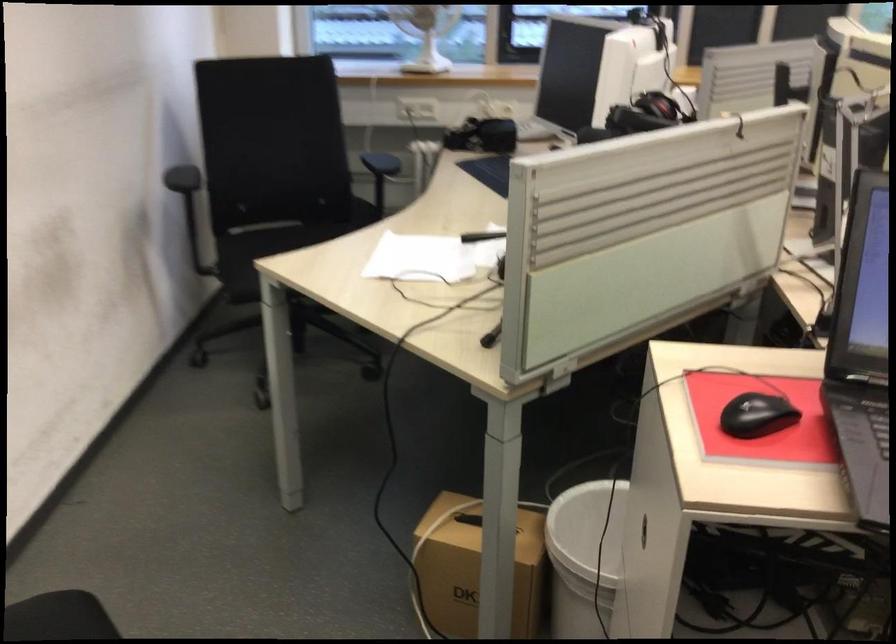
Find the location of a particular element. brown cardboard box is located at coordinates (474, 567).